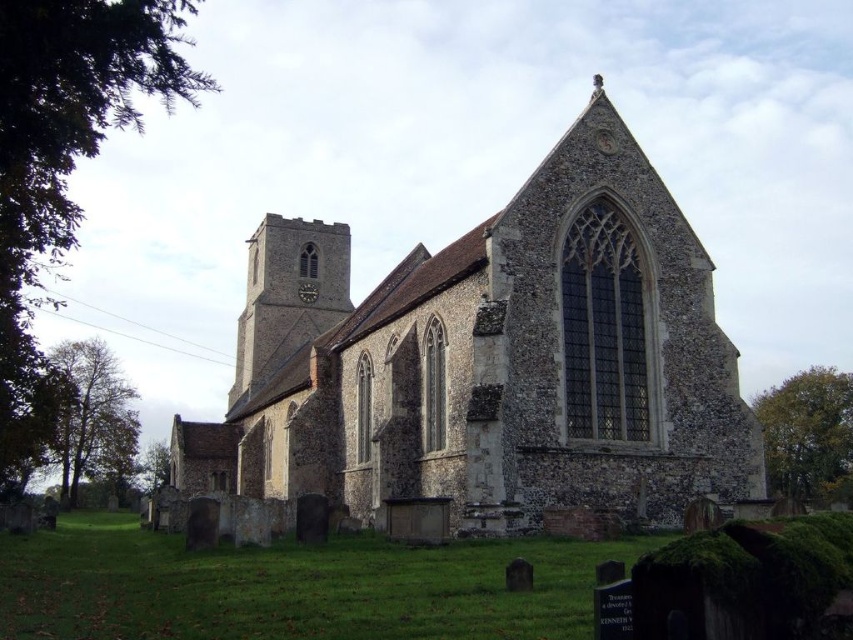
You are standing in front of the historic stone church and notice two points marked on its facade. The first point is at coordinates point (610, 378), and the second is at point (289, 321). Which of these points is nearer to your current position?

Point (610, 378) is closer to the viewer than point (289, 321), so the first point is nearer to your current position.

You are standing at the point marked as point (491, 360) in the image. What object is located exactly at this point?

The brown stone church at center is located exactly at point (491, 360).